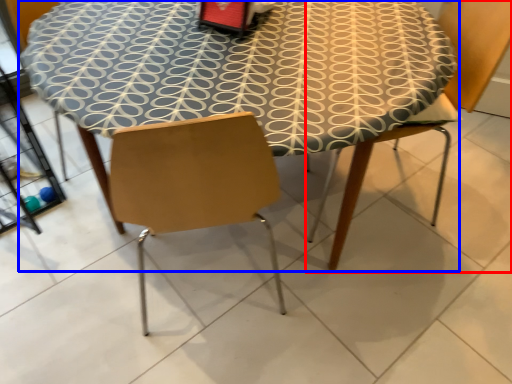
Question: Which point is closer to the camera, chair (highlighted by a red box) or table (highlighted by a blue box)?

Choices:
 (A) chair
 (B) table

Answer: (B)